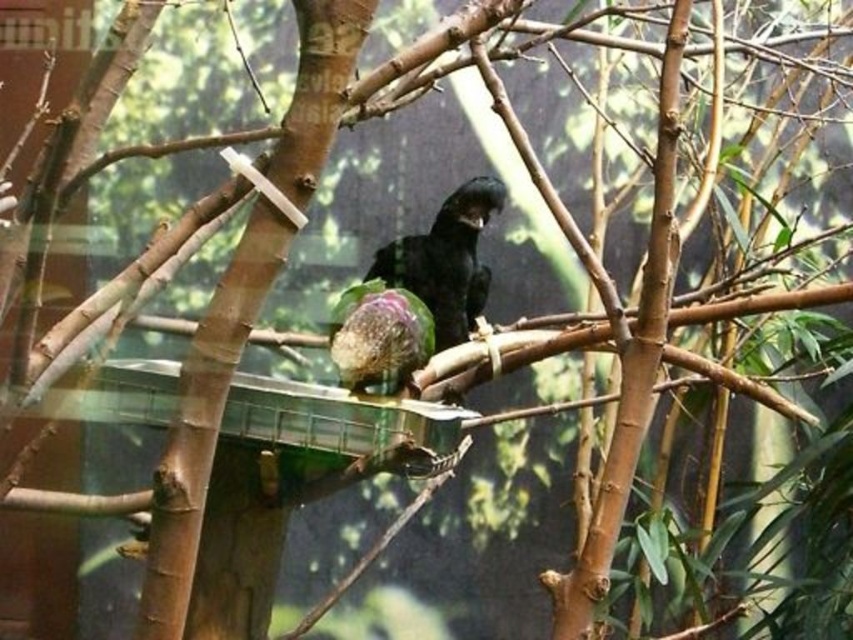
You are a zookeeper who needs to place a feeding tray between the shiny black bird at center and the speckled green parrot at center. Given that the tray requires a minimum of 30 cm of space, can you determine if there is enough space between them?

The shiny black bird at center is larger in width than the speckled green parrot at center, but the exact distance between them isn

You are a zookeeper observing the two birds in the aviary. You notice that the shiny black bird at center and the speckled green parrot at center are positioned in a specific way. Which bird is higher up on the branch?

The shiny black bird at center is located above the speckled green parrot at center, so the shiny black bird at center is higher up on the branch.

You are a zookeeper observing two birds in the aviary. You notice the shiny black bird at center and the speckled green parrot at center. Which bird do you think requires a larger perch based on their sizes?

The shiny black bird at center is larger than the speckled green parrot at center, so it requires a larger perch.